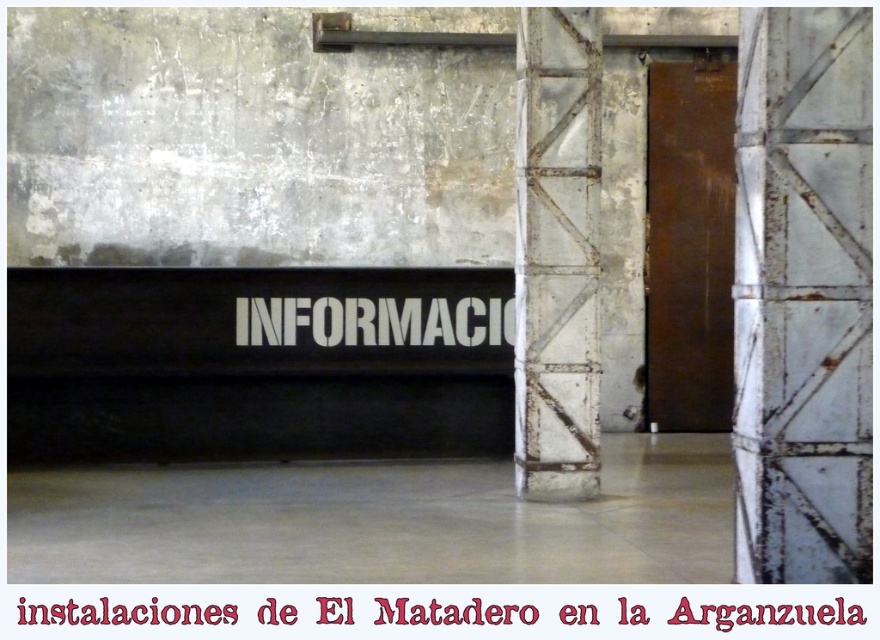
Is rusty metal pillar at center-right in front of white plastic sign at center?

That is True.

Describe the element at coordinates (556, 252) in the screenshot. I see `rusty metal pillar at center-right` at that location.

Who is more forward, [584,196] or [368,317]?

Positioned in front is point [584,196].

Identify the location of rusty metal pillar at center-right. This screenshot has width=880, height=640. (556, 252).

Which of these two, white painted metal pillar at center right or white paper text at center, stands shorter?

With less height is white paper text at center.

From the picture: Which is above, white painted metal pillar at center right or white paper text at center?

Positioned higher is white painted metal pillar at center right.

Who is more distant from viewer, (x=869, y=477) or (x=495, y=609)?

Positioned behind is point (x=495, y=609).

You are a GUI agent. You are given a task and a screenshot of the screen. Output one action in this format:
    pyautogui.click(x=<x>, y=<y>)
    Task: Click on the white painted metal pillar at center right
    The image size is (880, 640).
    Given the screenshot: What is the action you would take?
    pyautogui.click(x=803, y=296)

Does rusty metal pillar at center-right have a larger size compared to white paper text at center?

Correct, rusty metal pillar at center-right is larger in size than white paper text at center.

How much distance is there between rusty metal pillar at center-right and white paper text at center?

10.67 feet

Is point (565, 308) positioned in front of point (742, 605)?

That is False.

Find the location of a particular element. The width and height of the screenshot is (880, 640). rusty metal pillar at center-right is located at coordinates (556, 252).